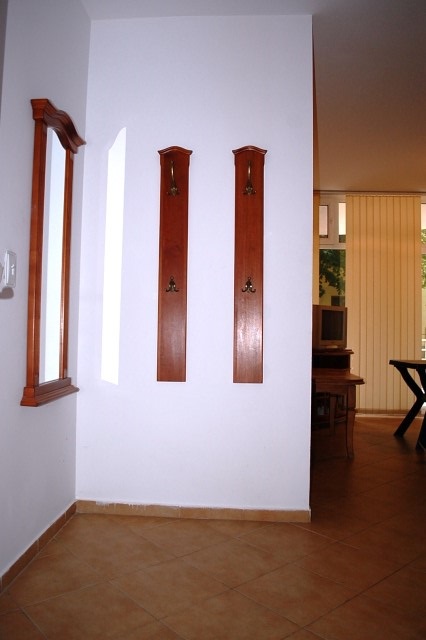
In order to click on furniture in this screenshot , I will do `click(422, 381)`, `click(339, 381)`.